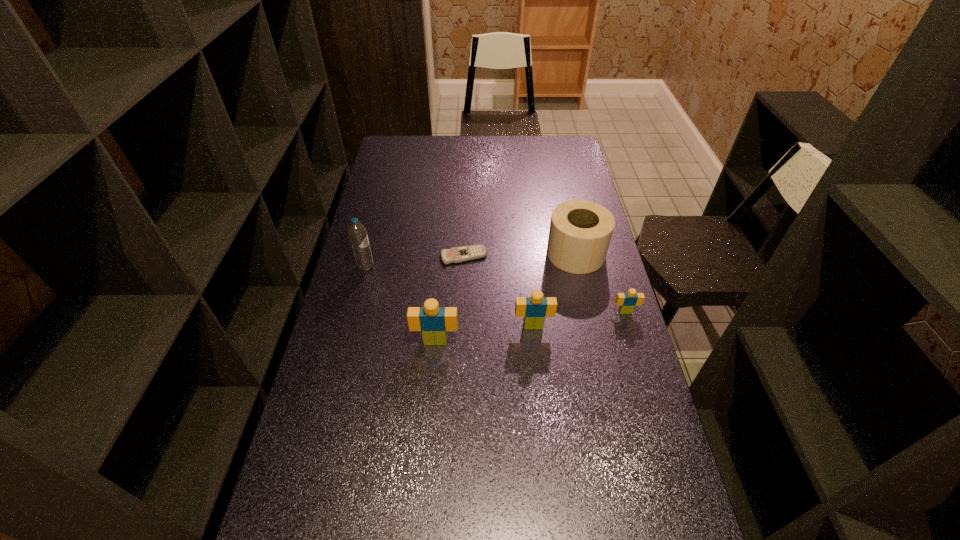
This screenshot has height=540, width=960. I want to click on vacant region at the near edge of the desktop, so click(395, 494).

You are a GUI agent. You are given a task and a screenshot of the screen. Output one action in this format:
    pyautogui.click(x=<x>, y=<y>)
    Task: Click on the free space at the left edge
    
    Given the screenshot: What is the action you would take?
    pyautogui.click(x=372, y=295)

This screenshot has width=960, height=540. What are the coordinates of `free space at the right edge` in the screenshot? It's located at (586, 352).

In order to click on vacant area at the far right corner of the desktop in this screenshot , I will do `click(559, 153)`.

Identify the location of vacant area that lies between the toilet tissue and the farthest Lego. point(601,282).

Locate an element on the screen. Image resolution: width=960 pixels, height=540 pixels. empty space between the rightmost Lego and the second nearest Lego is located at coordinates (579, 319).

Locate an element on the screen. The image size is (960, 540). free spot between the second shortest object and the toilet tissue is located at coordinates (601, 282).

Identify the location of vacant space that's between the shortest Lego and the remote control. Image resolution: width=960 pixels, height=540 pixels. (544, 284).

Identify the location of free space between the tallest object and the shortest object. Image resolution: width=960 pixels, height=540 pixels. (415, 261).

The image size is (960, 540). I want to click on free space between the toilet tissue and the water bottle, so coord(471,260).